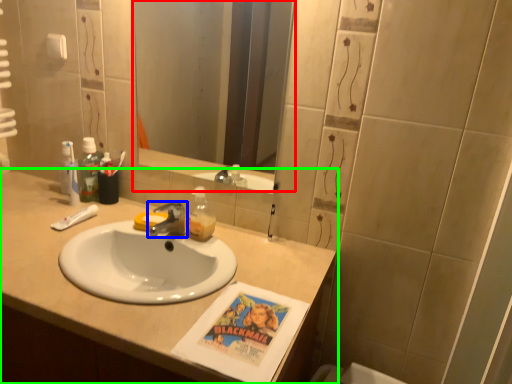
Question: Estimate the real-world distances between objects in this image. Which object is farther from mirror (highlighted by a red box), tap (highlighted by a blue box) or bathroom cabinet (highlighted by a green box)?

Choices:
 (A) tap
 (B) bathroom cabinet

Answer: (A)